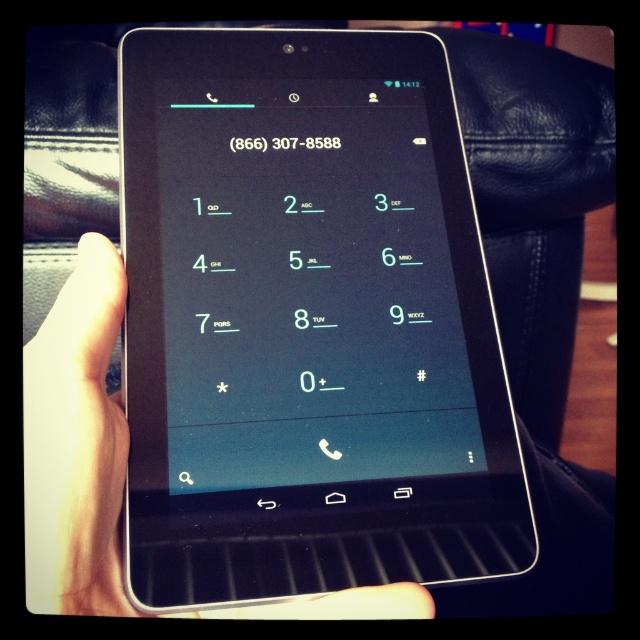
Question: Is black glossy tablet at center thinner than white matte hand at center?

Choices:
 (A) yes
 (B) no

Answer: (B)

Question: Which point is closer to the camera taking this photo?

Choices:
 (A) (401, 372)
 (B) (120, 593)

Answer: (B)

Question: Among these points, which one is nearest to the camera?

Choices:
 (A) (113, 484)
 (B) (221, 148)

Answer: (A)

Question: Does black glossy tablet at center have a smaller size compared to white matte hand at center?

Choices:
 (A) no
 (B) yes

Answer: (A)

Question: Among these objects, which one is nearest to the camera?

Choices:
 (A) black glossy tablet at center
 (B) white matte hand at center

Answer: (B)

Question: From the image, what is the correct spatial relationship of black glossy tablet at center in relation to white matte hand at center?

Choices:
 (A) left
 (B) right

Answer: (B)